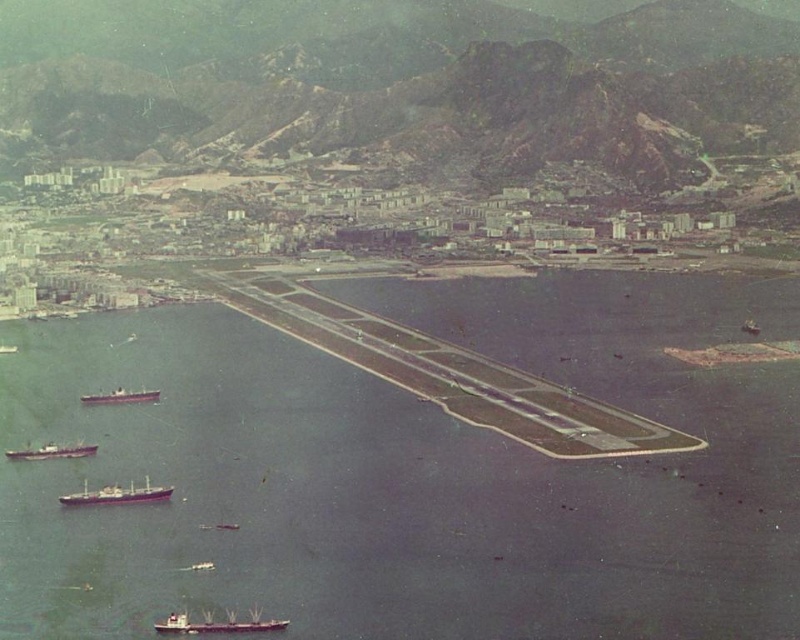
Question: Which of the following is the farthest from the observer?

Choices:
 (A) blue water at center
 (B) brown matte ship at lower left
 (C) purple matte cargo ship at lower left

Answer: (B)

Question: Where is metallic gray cargo ship at lower center located in relation to purple matte cargo ship at lower left in the image?

Choices:
 (A) right
 (B) left

Answer: (A)

Question: Observing the image, what is the correct spatial positioning of blue water at center in reference to brown matte ship at lower left?

Choices:
 (A) below
 (B) above

Answer: (A)

Question: Is metallic gray cargo ship at lower center above brown matte ship at lower left?

Choices:
 (A) yes
 (B) no

Answer: (B)

Question: Based on their relative distances, which object is farther from the blue water at center?

Choices:
 (A) brown matte ship at lower left
 (B) purple matte cargo ship at lower left
 (C) metallic gray ship at lower left
 (D) metallic gray cargo ship at lower center

Answer: (A)

Question: Which of the following is the closest to the observer?

Choices:
 (A) purple matte cargo ship at lower left
 (B) metallic gray ship at lower left
 (C) blue water at center

Answer: (C)